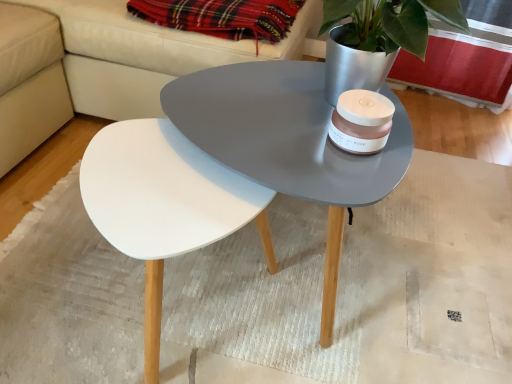
Measure the distance between plaid fabric at upper center and camera.

A distance of 1.23 meters exists between plaid fabric at upper center and camera.

Find the location of `plaid fabric at upper center`. plaid fabric at upper center is located at coordinates (222, 17).

Consider the image. From a real-world perspective, is white leather couch at upper center over plaid fabric at upper center?

Actually, white leather couch at upper center is physically below plaid fabric at upper center in the real world.

Is point (102, 13) farther from camera compared to point (271, 29)?

Yes, it is.

Is the surface of white leather couch at upper center in direct contact with plaid fabric at upper center?

They are not placed beside each other.

Is white leather couch at upper center shorter than plaid fabric at upper center?

In fact, white leather couch at upper center may be taller than plaid fabric at upper center.

Which object is further away from the camera, plaid fabric at upper center or white matte mat at center?

plaid fabric at upper center is further from the camera.

Based on their positions, is plaid fabric at upper center located to the left or right of white matte mat at center?

plaid fabric at upper center is positioned on white matte mat at center's left side.

How different are the orientations of plaid fabric at upper center and white matte mat at center in degrees?

The facing directions of plaid fabric at upper center and white matte mat at center are 88.6 degrees apart.

Would you say plaid fabric at upper center contains white matte mat at center?

No, white matte mat at center is located outside of plaid fabric at upper center.

Does plaid fabric at upper center come behind white leather couch at upper center?

Yes.

From a real-world perspective, who is located lower, plaid fabric at upper center or white leather couch at upper center?

white leather couch at upper center is physically lower.

How many degrees apart are the facing directions of plaid fabric at upper center and white leather couch at upper center?

The facing directions of plaid fabric at upper center and white leather couch at upper center are 0.000314 degrees apart.

Looking at this image, is plaid fabric at upper center bigger than white leather couch at upper center?

Incorrect, plaid fabric at upper center is not larger than white leather couch at upper center.

Which of these two, white matte mat at center or plaid fabric at upper center, stands shorter?

white matte mat at center is shorter.

From the picture: Does white matte mat at center touch plaid fabric at upper center?

No, white matte mat at center is not with plaid fabric at upper center.

From a real-world perspective, is white matte mat at center positioned above or below plaid fabric at upper center?

In terms of real-world spatial position, white matte mat at center is below plaid fabric at upper center.

From the image's perspective, is white matte mat at center located above white leather couch at upper center?

Actually, white matte mat at center appears below white leather couch at upper center in the image.

This screenshot has width=512, height=384. I want to click on couch located above the white matte mat at center (from a real-world perspective), so click(146, 54).

How far apart are white matte mat at center and white leather couch at upper center?

white matte mat at center is 56.65 centimeters from white leather couch at upper center.

Considering the points (139, 329) and (60, 21), which point is behind, point (139, 329) or point (60, 21)?

The point (60, 21) is farther.

Does point (205, 50) come closer to viewer compared to point (25, 328)?

That is False.

Consider the image. Are white leather couch at upper center and white matte mat at center far apart?

No, white leather couch at upper center is in close proximity to white matte mat at center.

This screenshot has height=384, width=512. I want to click on couch above the white matte mat at center (from the image's perspective), so click(146, 54).

Between white leather couch at upper center and white matte mat at center, which one appears on the right side from the viewer's perspective?

From the viewer's perspective, white matte mat at center appears more on the right side.

Locate an element on the screen. couch in front of the plaid fabric at upper center is located at coordinates (146, 54).

Where is `blanket located above the white matte mat at center (from the image's perspective)`? The width and height of the screenshot is (512, 384). blanket located above the white matte mat at center (from the image's perspective) is located at coordinates (222, 17).

Which object lies further to the anchor point plaid fabric at upper center, white matte mat at center or white leather couch at upper center?

white matte mat at center lies further to plaid fabric at upper center than the other object.

Based on their spatial positions, is plaid fabric at upper center or white matte mat at center further from white leather couch at upper center?

white matte mat at center is further to white leather couch at upper center.

Which object lies further to the anchor point plaid fabric at upper center, white leather couch at upper center or white matte mat at center?

white matte mat at center lies further to plaid fabric at upper center than the other object.

Looking at the image, which one is located further to white matte mat at center, plaid fabric at upper center or white leather couch at upper center?

plaid fabric at upper center lies further to white matte mat at center than the other object.

Estimate the real-world distances between objects in this image. Which object is closer to white leather couch at upper center, white matte mat at center or plaid fabric at upper center?

plaid fabric at upper center lies closer to white leather couch at upper center than the other object.

When comparing their distances from white matte mat at center, does white leather couch at upper center or plaid fabric at upper center seem closer?

Based on the image, white leather couch at upper center appears to be nearer to white matte mat at center.

Find the location of a particular element. The height and width of the screenshot is (384, 512). blanket between white leather couch at upper center and white matte mat at center from top to bottom is located at coordinates (222, 17).